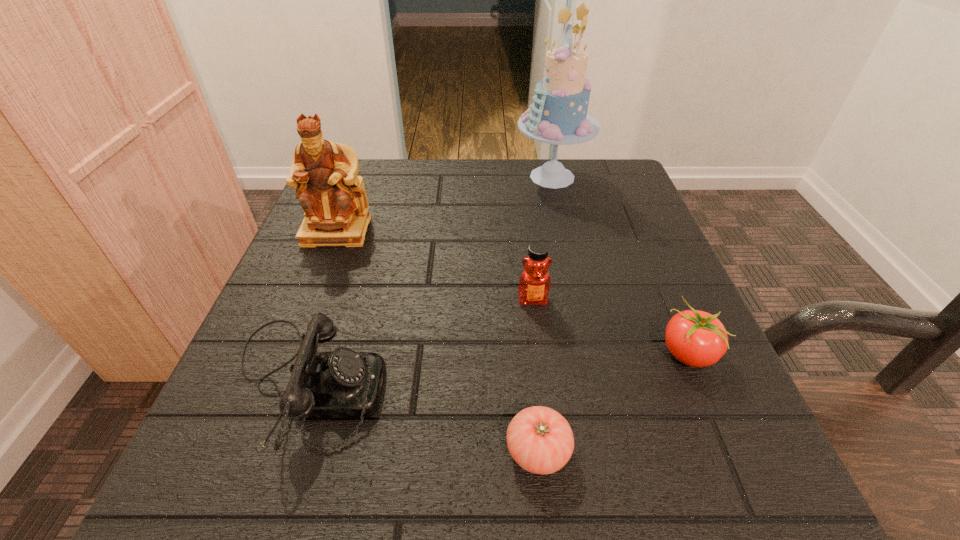
Locate an element on the screen. The image size is (960, 540). vacant point that satisfies the following two spatial constraints: 1. on the front label of the fourth nearest object; 2. on the left side of the taller tomato is located at coordinates (540, 353).

You are a GUI agent. You are given a task and a screenshot of the screen. Output one action in this format:
    pyautogui.click(x=<x>, y=<y>)
    Task: Click on the free spot that satisfies the following two spatial constraints: 1. on the front label of the third farthest object; 2. on the right side of the rightmost object
    This screenshot has height=540, width=960.
    Given the screenshot: What is the action you would take?
    pyautogui.click(x=540, y=353)

Locate an element on the screen. Image resolution: width=960 pixels, height=540 pixels. vacant point that satisfies the following two spatial constraints: 1. with a ladder on the side of the farthest object; 2. on the front-facing side of the second farthest object is located at coordinates (564, 231).

The image size is (960, 540). What are the coordinates of `vacant space that satisfies the following two spatial constraints: 1. with a ladder on the side of the rightmost object; 2. on the right side of the tallest object` in the screenshot? It's located at (593, 353).

What are the coordinates of `free space that satisfies the following two spatial constraints: 1. on the front-facing side of the shortest object; 2. on the left side of the telephone` in the screenshot? It's located at (283, 450).